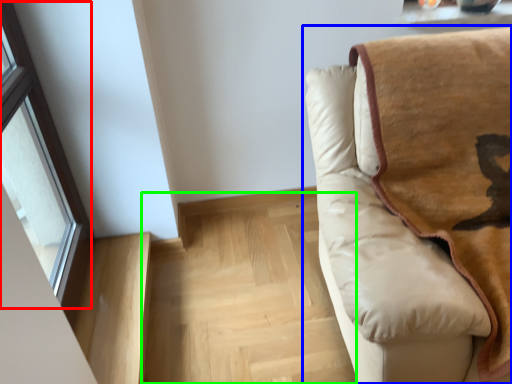
Question: Based on their relative distances, which object is farther from window (highlighted by a red box)? Choose from studio couch (highlighted by a blue box) and stairwell (highlighted by a green box).

Choices:
 (A) studio couch
 (B) stairwell

Answer: (A)